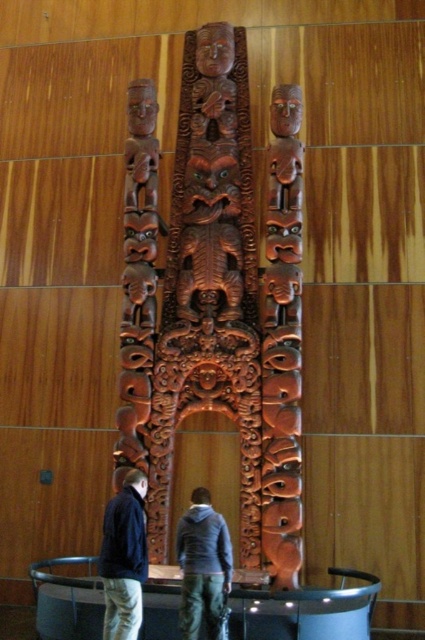
Question: Which point is farther to the camera?

Choices:
 (A) (130, 508)
 (B) (141, 576)
 (C) (261, 337)
 (D) (218, 593)

Answer: (C)

Question: From the image, what is the correct spatial relationship of polished wood carving at center in relation to gray hoodie at center?

Choices:
 (A) below
 (B) above

Answer: (B)

Question: Which of these objects is positioned closest to the gray hoodie at center?

Choices:
 (A) dark blue jacket at lower left
 (B) polished wood carving at center
 (C) dark gray hoodie at center

Answer: (C)

Question: Which object is closer to the camera taking this photo?

Choices:
 (A) dark blue jacket at lower left
 (B) polished wood carving at center
 (C) dark gray hoodie at center

Answer: (C)

Question: Can you confirm if polished wood carving at center is positioned to the left of dark blue jacket at lower left?

Choices:
 (A) no
 (B) yes

Answer: (A)

Question: Is dark gray hoodie at center bigger than gray hoodie at center?

Choices:
 (A) no
 (B) yes

Answer: (B)